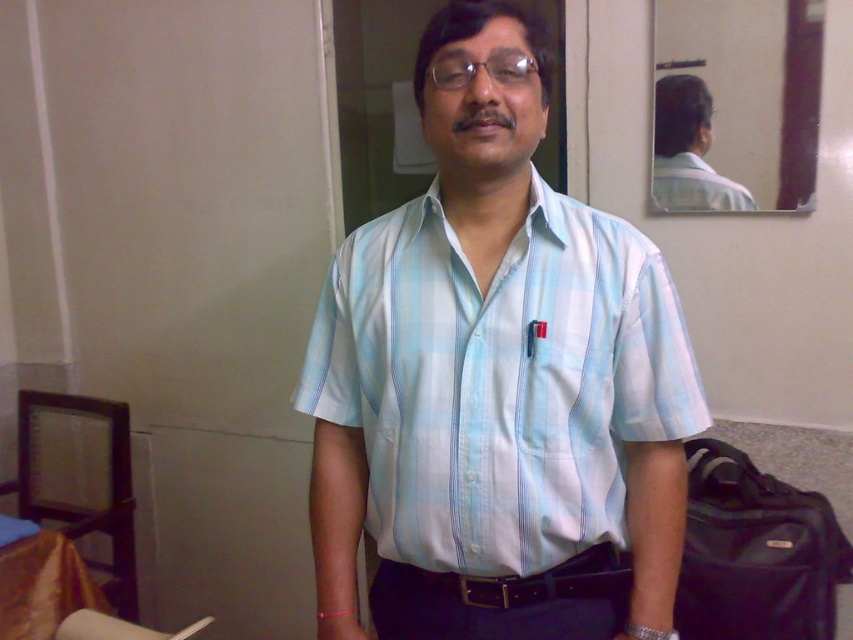
Can you confirm if light blue plaid shirt at center is thinner than light blue plaid shirt at upper center?

No.

Who is more forward, (363, 368) or (654, 88)?

Point (363, 368)

This screenshot has height=640, width=853. In order to click on light blue plaid shirt at center in this screenshot , I will do `click(495, 378)`.

Can you confirm if light blue plaid shirt at center is smaller than clear plastic glasses at center?

Actually, light blue plaid shirt at center might be larger than clear plastic glasses at center.

Does light blue plaid shirt at center come behind clear plastic glasses at center?

No, light blue plaid shirt at center is closer to the viewer.

The image size is (853, 640). What do you see at coordinates (495, 378) in the screenshot? I see `light blue plaid shirt at center` at bounding box center [495, 378].

This screenshot has height=640, width=853. Find the location of `light blue plaid shirt at center`. light blue plaid shirt at center is located at coordinates (495, 378).

At what (x,y) coordinates should I click in order to perform the action: click on light blue plaid shirt at center. Please return your answer as a coordinate pair (x, y). This screenshot has height=640, width=853. Looking at the image, I should click on (495, 378).

Can you confirm if light blue plaid shirt at center is positioned to the right of black fabric bag at lower right?

No, light blue plaid shirt at center is not to the right of black fabric bag at lower right.

Where is `light blue plaid shirt at center`? This screenshot has height=640, width=853. light blue plaid shirt at center is located at coordinates (495, 378).